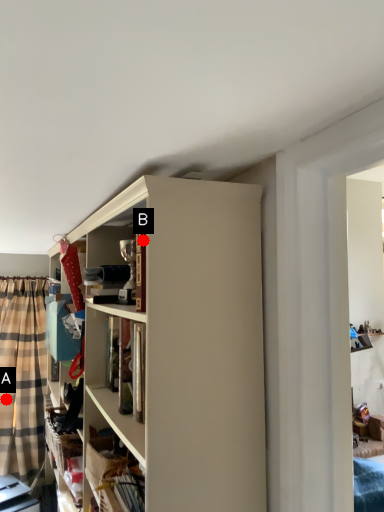
Question: Two points are circled on the image, labeled by A and B beside each circle. Which of the following is the closest to the observer?

Choices:
 (A) A is closer
 (B) B is closer

Answer: (B)